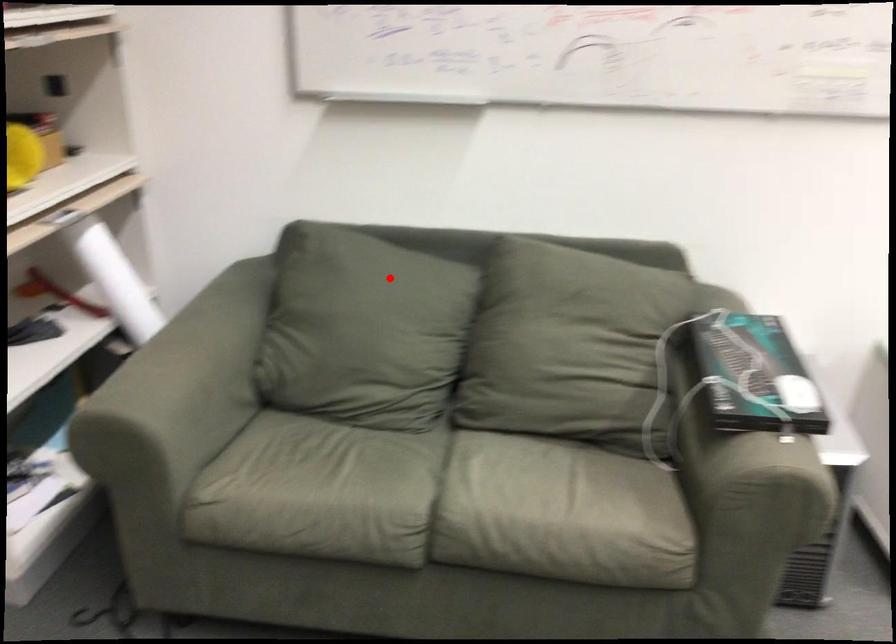
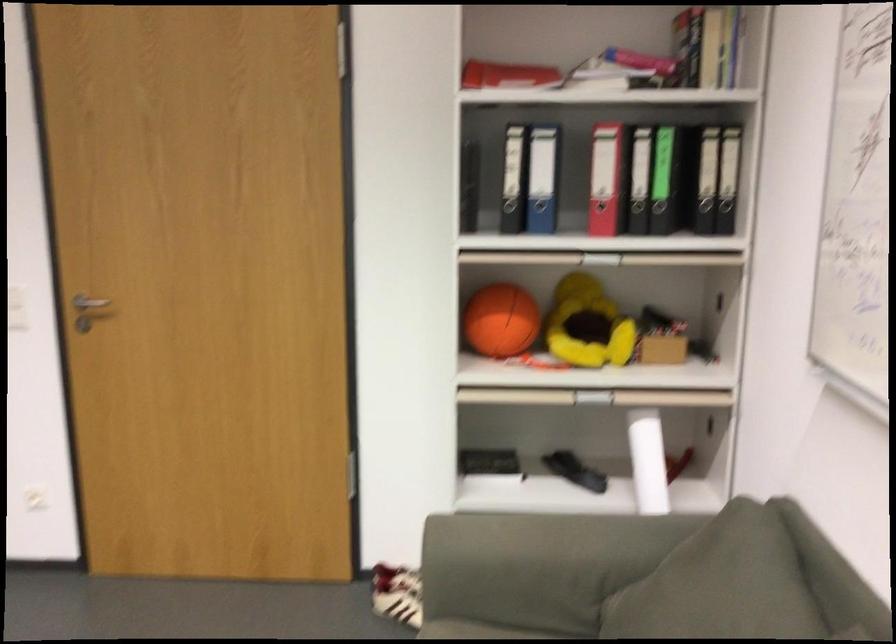
Question: I am providing you with two images of the same scene from different viewpoints. A red point is shown in image1. For the corresponding object point in image2, is it positioned nearer or farther from the camera?

Choices:
 (A) Nearer
 (B) Farther

Answer: (A)